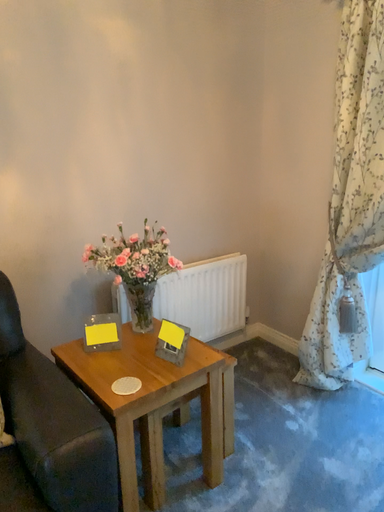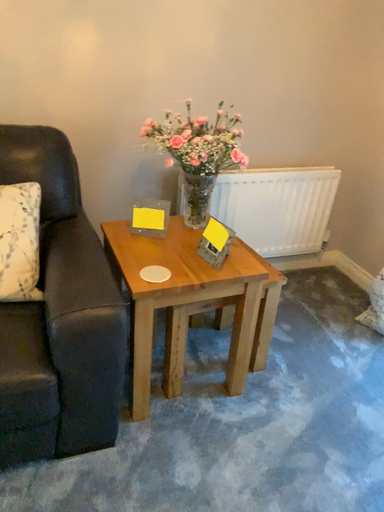
Question: How did the camera likely rotate when shooting the video?

Choices:
 (A) rotated downward
 (B) rotated upward

Answer: (A)